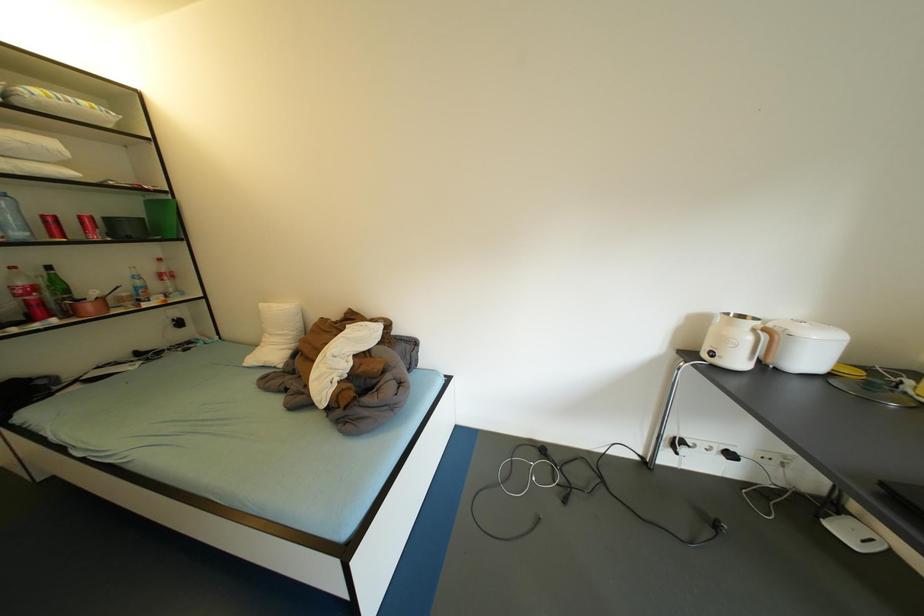
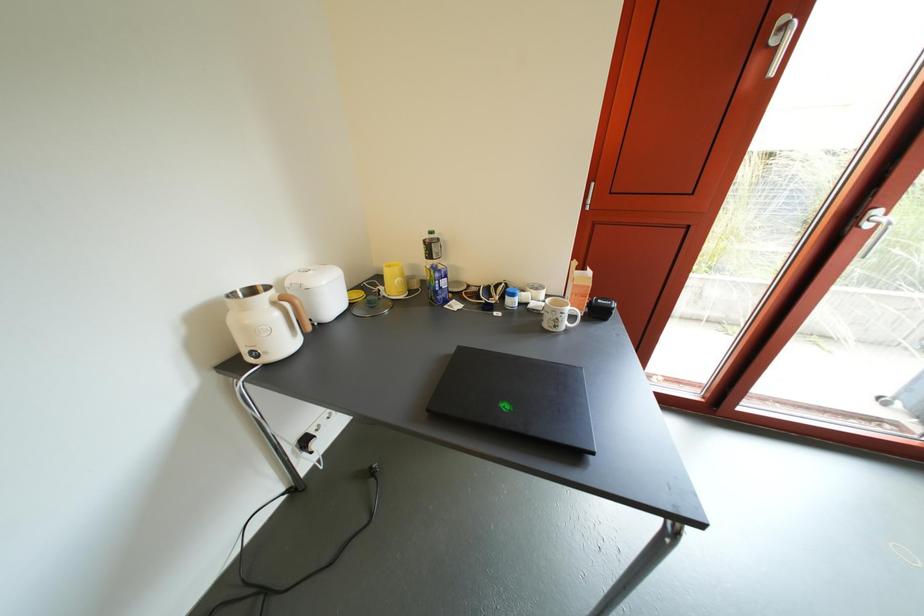
The images are taken continuously from a first-person perspective. In which direction is your viewpoint rotating?

The camera's rotation is toward right-down.